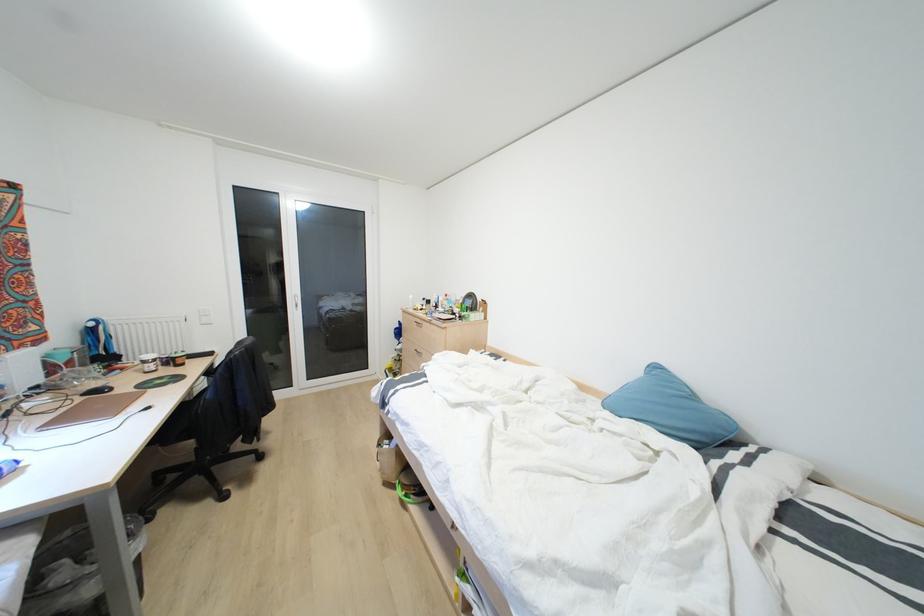
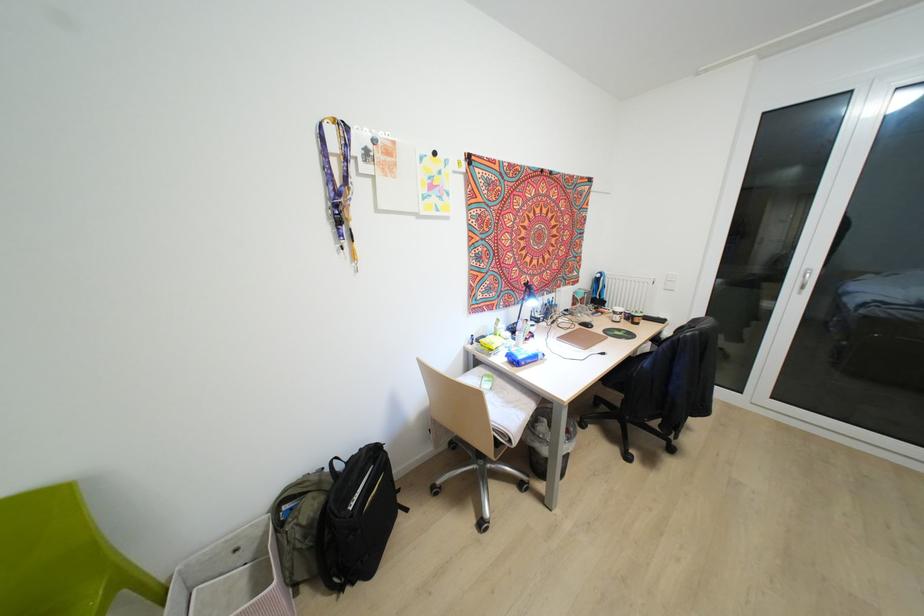
Question: The images are taken continuously from a first-person perspective. In which direction is your viewpoint rotating?

Choices:
 (A) Left
 (B) Right
 (C) Up
 (D) Down

Answer: (A)